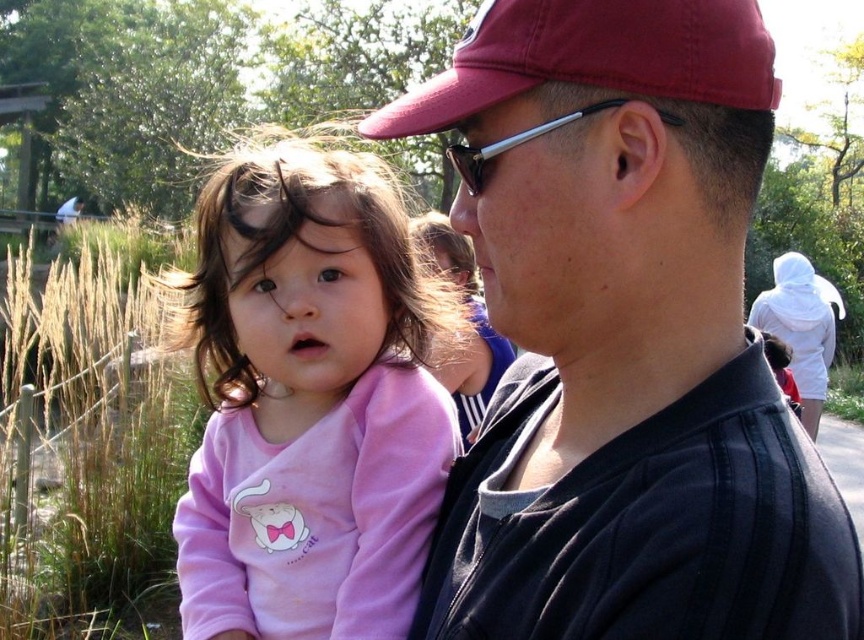
Between pink fleece at center and maroon fabric baseball cap at center, which one has less height?

With less height is maroon fabric baseball cap at center.

Is point (325, 570) farther from camera compared to point (569, 3)?

Yes, point (325, 570) is farther from viewer.

The width and height of the screenshot is (864, 640). In order to click on pink fleece at center in this screenshot , I will do `click(309, 401)`.

Does point (648, 269) lie behind point (324, 355)?

That is False.

Is point (615, 534) positioned before point (261, 307)?

That is True.

Where is `matte black shirt at center`? This screenshot has width=864, height=640. matte black shirt at center is located at coordinates (623, 339).

Can you confirm if matte black shirt at center is positioned to the right of maroon fabric baseball cap at center?

Yes, matte black shirt at center is to the right of maroon fabric baseball cap at center.

Is matte black shirt at center below maroon fabric baseball cap at center?

Yes.

Does point (634, 444) come farther from viewer compared to point (385, 108)?

That is False.

Where is `matte black shirt at center`? The width and height of the screenshot is (864, 640). matte black shirt at center is located at coordinates (623, 339).